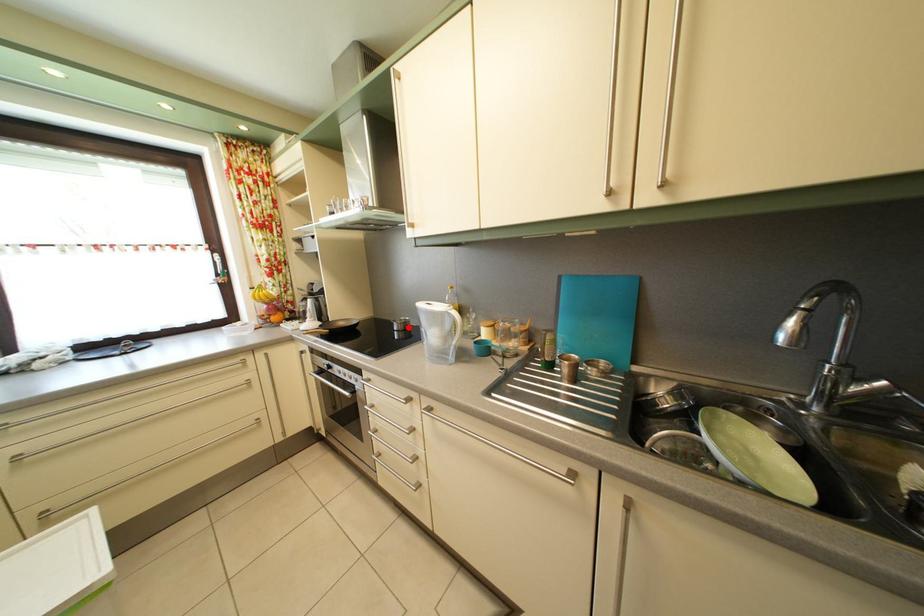
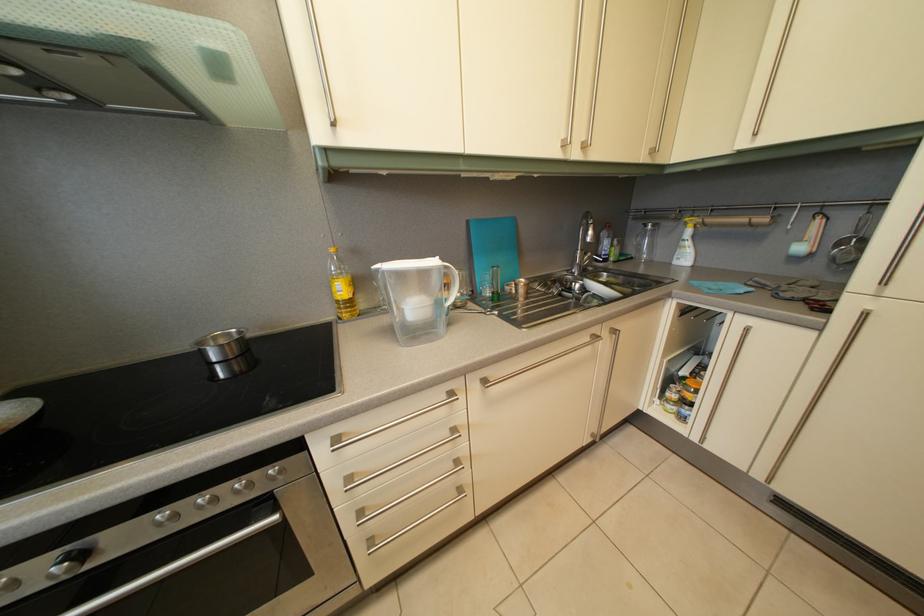
The point at the highlighted location is marked in the first image. Where is the corresponding point in the second image?

(224, 346)